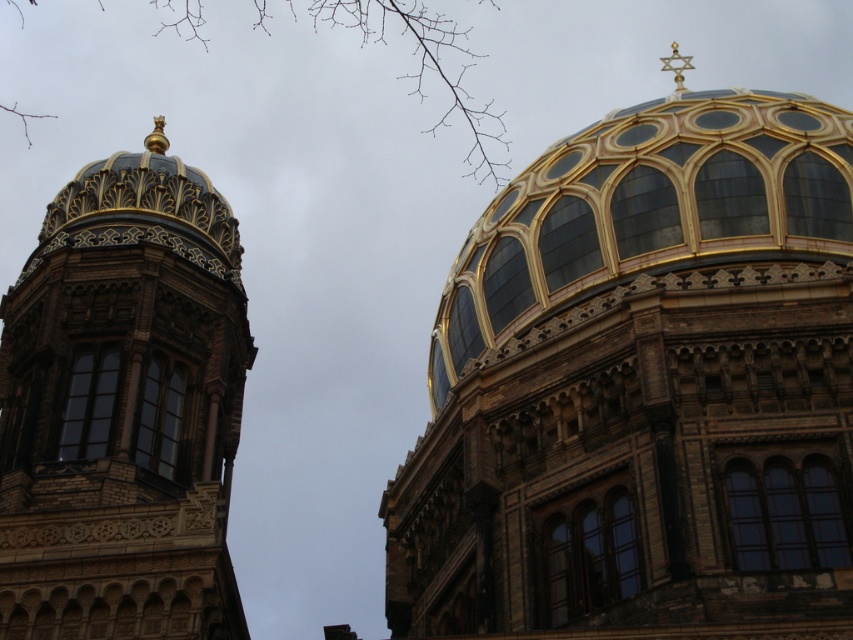
How far apart are golden glass dome at upper right and gold mosaic dome at upper left?

A distance of 17.12 meters exists between golden glass dome at upper right and gold mosaic dome at upper left.

Can you confirm if golden glass dome at upper right is positioned above gold mosaic dome at upper left?

Indeed, golden glass dome at upper right is positioned over gold mosaic dome at upper left.

Is point (575, 513) behind point (114, 243)?

No.

The image size is (853, 640). I want to click on golden glass dome at upper right, so click(x=642, y=381).